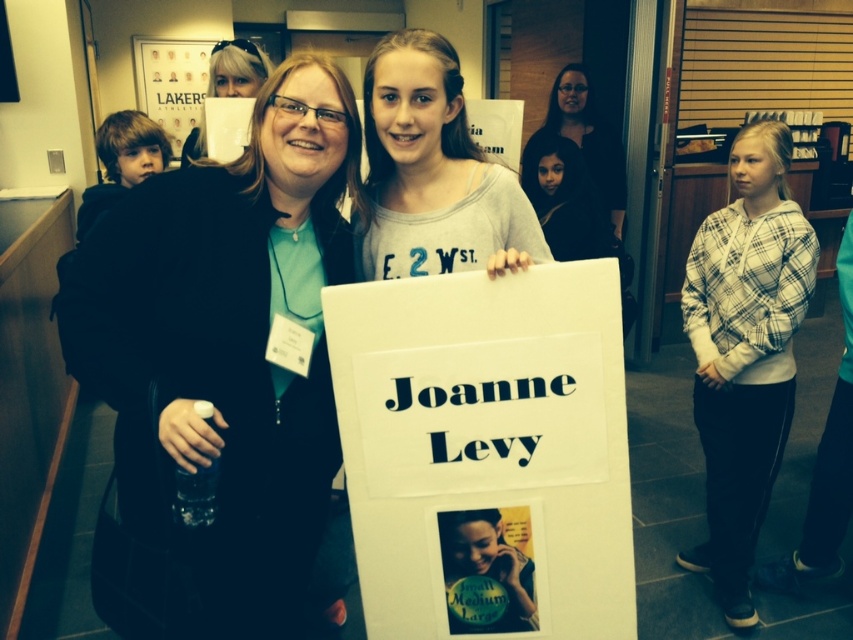
Question: Can you confirm if matte black shirt at upper center is bigger than matte black jacket at upper center?

Choices:
 (A) yes
 (B) no

Answer: (A)

Question: Estimate the real-world distances between objects in this image. Which object is farther from the white plaid hoodie at right?

Choices:
 (A) matte black jacket at upper center
 (B) gray cotton shirt at center
 (C) matte black jacket at center
 (D) white paper poster at upper left

Answer: (D)

Question: Based on their relative distances, which object is nearer to the gray cotton shirt at center?

Choices:
 (A) white paper sign at center
 (B) white plaid hoodie at right
 (C) matte black jacket at upper center
 (D) matte black shirt at upper center

Answer: (A)

Question: From the image, what is the correct spatial relationship of white paper sign at center in relation to matte black shirt at upper center?

Choices:
 (A) left
 (B) right

Answer: (A)

Question: Which object is closer to the camera taking this photo?

Choices:
 (A) matte black jacket at upper center
 (B) gray cotton shirt at center

Answer: (B)

Question: Where is white paper sign at center located in relation to matte black shirt at upper center in the image?

Choices:
 (A) left
 (B) right

Answer: (A)